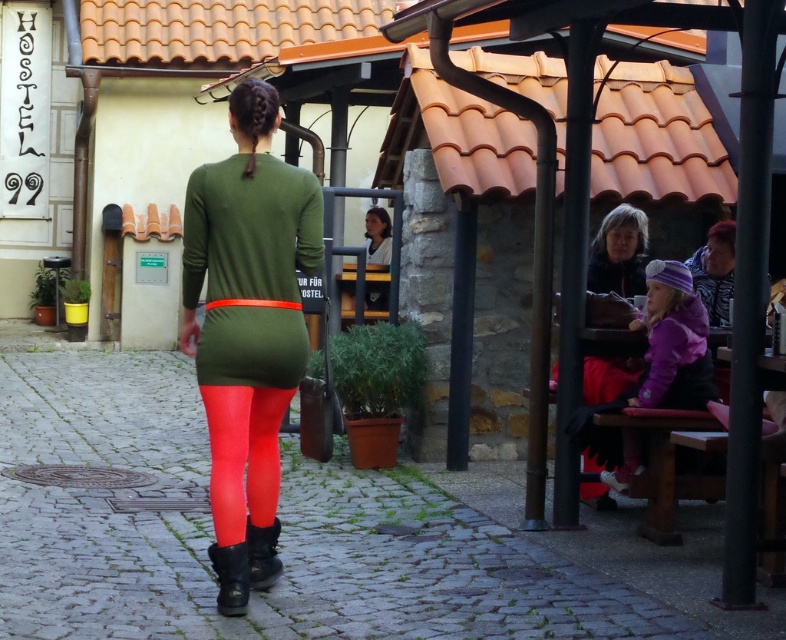
Is neon matte leggings at lower center positioned behind leather boot at center?

That is False.

Is point (223, 508) in front of point (256, 529)?

Yes, point (223, 508) is closer to viewer.

This screenshot has width=786, height=640. What are the coordinates of `neon matte leggings at lower center` in the screenshot? It's located at (243, 456).

In the scene shown: Does purple fleece jacket at lower right appear over matte black jacket at upper right?

No, purple fleece jacket at lower right is not above matte black jacket at upper right.

What are the coordinates of `purple fleece jacket at lower right` in the screenshot? It's located at (674, 340).

Locate an element on the screen. purple fleece jacket at lower right is located at coordinates (674, 340).

Can you confirm if purple fleece jacket at lower right is wider than leather boot at lower center?

Indeed, purple fleece jacket at lower right has a greater width compared to leather boot at lower center.

Can you confirm if purple fleece jacket at lower right is positioned above leather boot at lower center?

Yes, purple fleece jacket at lower right is above leather boot at lower center.

Describe the element at coordinates (674, 340) in the screenshot. I see `purple fleece jacket at lower right` at that location.

I want to click on purple fleece jacket at lower right, so click(x=674, y=340).